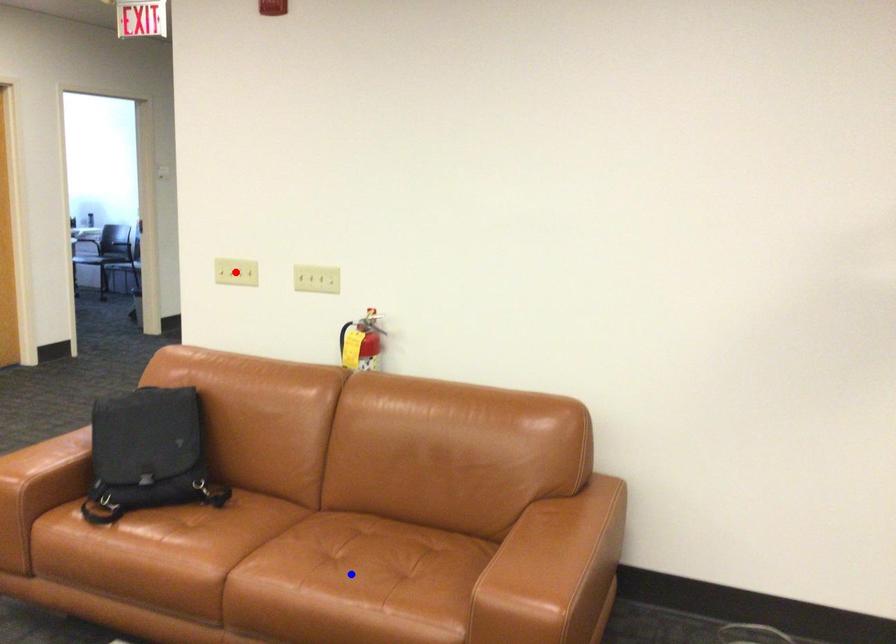
Question: In the image, two points are highlighted. Which point is nearer to the camera? Reply with the corresponding letter.

Choices:
 (A) blue point
 (B) red point

Answer: (A)